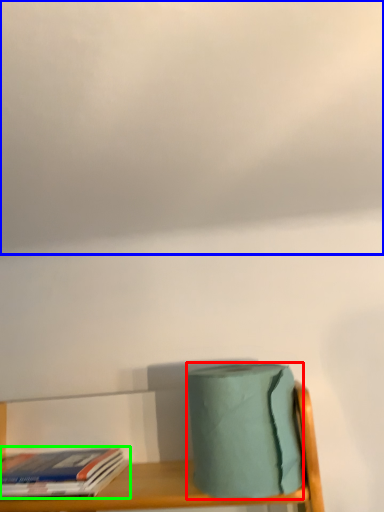
Question: Based on their relative distances, which object is nearer to toilet paper (highlighted by a red box)? Choose from cloud (highlighted by a blue box) and book (highlighted by a green box).

Choices:
 (A) cloud
 (B) book

Answer: (B)